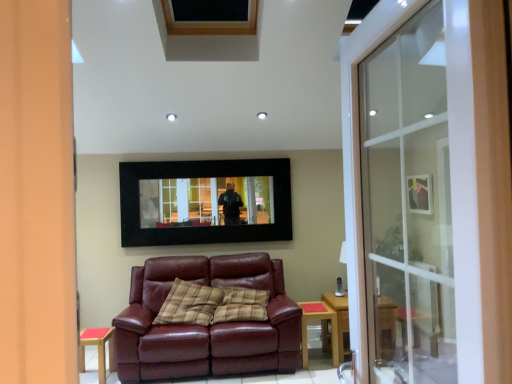
Question: Do you think plaid fabric pillow at center is within light brown wooden side table at lower center, or outside of it?

Choices:
 (A) outside
 (B) inside

Answer: (A)

Question: Considering the positions of point (172, 322) and point (317, 314), is point (172, 322) closer or farther from the camera than point (317, 314)?

Choices:
 (A) closer
 (B) farther

Answer: (A)

Question: Estimate the real-world distances between objects in this image. Which object is closer to the transparent glass screen door at right?

Choices:
 (A) light brown wooden side table at lower center
 (B) black matte picture frame at center, which appears as the second picture frame when viewed from the right
 (C) matte black picture frame at upper right, acting as the second picture frame starting from the left
 (D) wooden side table at lower left
 (E) plaid fabric pillow at center

Answer: (C)

Question: Based on their relative distances, which object is farther from the matte black picture frame at upper right, which is counted as the 1th picture frame, starting from the right?

Choices:
 (A) transparent glass screen door at right
 (B) matte leather couch at center
 (C) plaid fabric pillow at center
 (D) wooden side table at lower left
 (E) light brown wooden side table at lower center

Answer: (D)